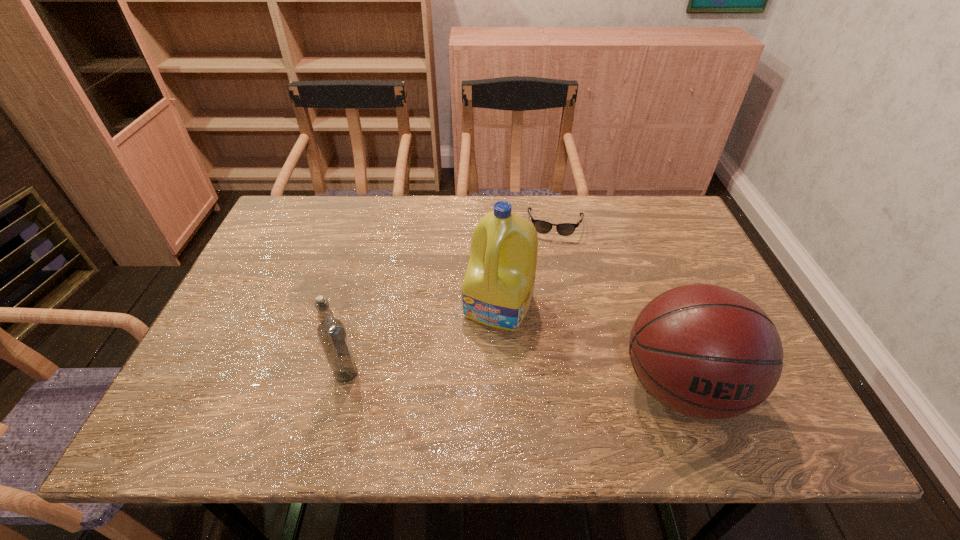
Locate an element on the screen. vodka is located at coordinates [x=331, y=332].

What are the coordinates of `basketball` in the screenshot? It's located at (704, 351).

Locate an element on the screen. sunglasses is located at coordinates (565, 229).

Locate an element on the screen. The width and height of the screenshot is (960, 540). the shortest object is located at coordinates (565, 229).

Find the location of a particular element. The image size is (960, 540). the second object from left to right is located at coordinates (497, 289).

At what (x,y) coordinates should I click in order to perform the action: click on detergent. Please return your answer as a coordinate pair (x, y). This screenshot has width=960, height=540. Looking at the image, I should click on (497, 289).

Image resolution: width=960 pixels, height=540 pixels. Identify the location of free space located on the label of the vodka. (492, 374).

The image size is (960, 540). In order to click on vacant area located on the front-facing side of the sunglasses in this screenshot , I will do `click(551, 268)`.

Find the location of `vacant area located 0.130m on the front-facing side of the sunglasses`. vacant area located 0.130m on the front-facing side of the sunglasses is located at coordinates (551, 271).

The width and height of the screenshot is (960, 540). I want to click on free space located 0.190m on the front-facing side of the sunglasses, so click(x=549, y=286).